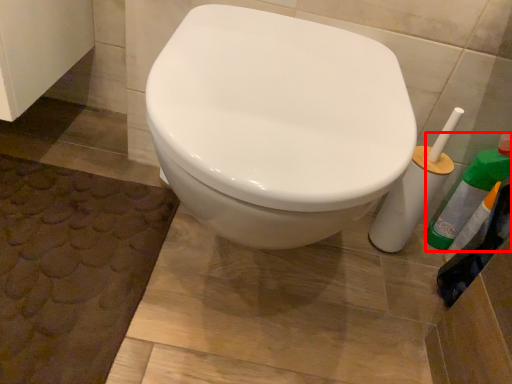
Question: From the image, what is the correct spatial relationship of cleaning product (annotated by the red box) in relation to bath mat?

Choices:
 (A) left
 (B) right

Answer: (B)